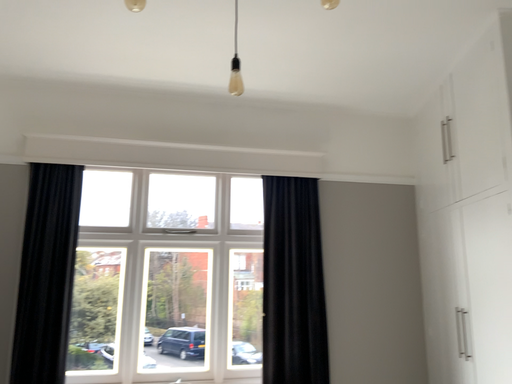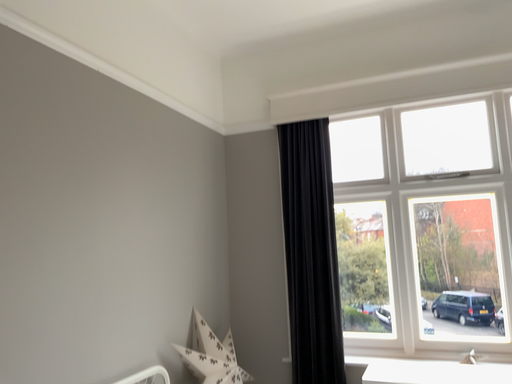
Question: Which way did the camera rotate in the video?

Choices:
 (A) rotated upward
 (B) rotated downward

Answer: (B)